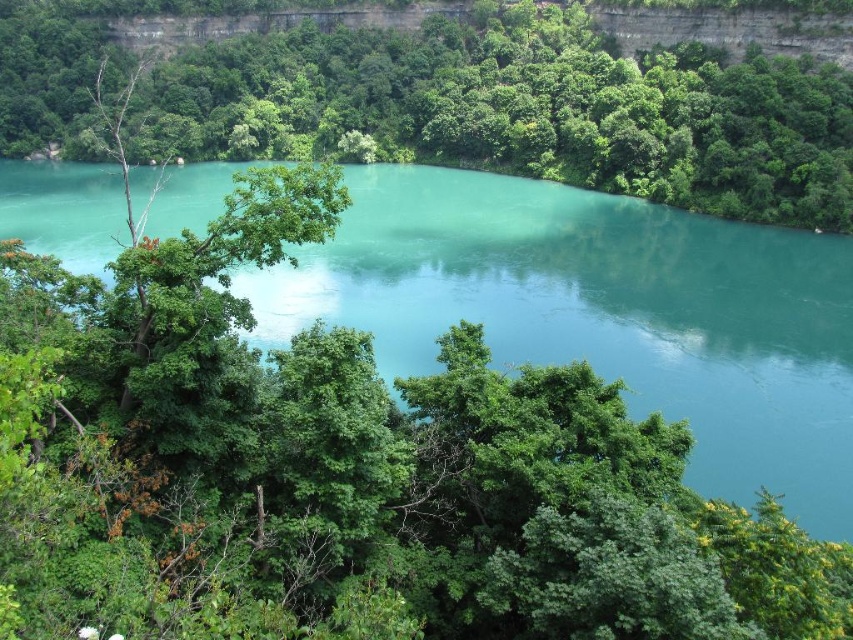
You are standing at the edge of the landscape and want to walk from the turquoise glossy water at center to the green leafy tree at center. How far will you have to walk?

The turquoise glossy water at center is 31.58 meters away from the green leafy tree at center, so you will have to walk 31.58 meters to reach the green leafy tree at center from the turquoise glossy water at center.

You are standing in the middle of the forest and see the turquoise glossy water at center and the green leafy tree at center. Which object is closer to the ground?

The turquoise glossy water at center is closer to the ground because it is located below the green leafy tree at center.

You are standing in the middle of the landscape and see the point labeled as point (x=602, y=314). What is located at that point?

The point (x=602, y=314) corresponds to the turquoise glossy water at center.